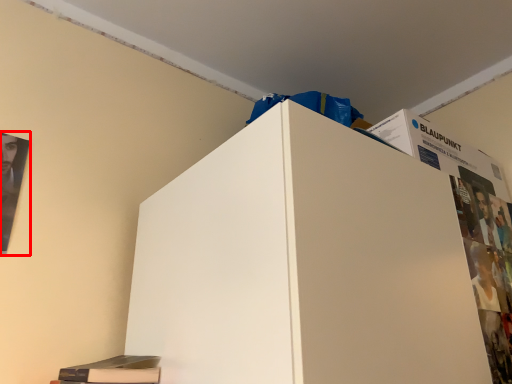
Question: Observing the image, what is the correct spatial positioning of poster page (annotated by the red box) in reference to magazine?

Choices:
 (A) right
 (B) left

Answer: (B)